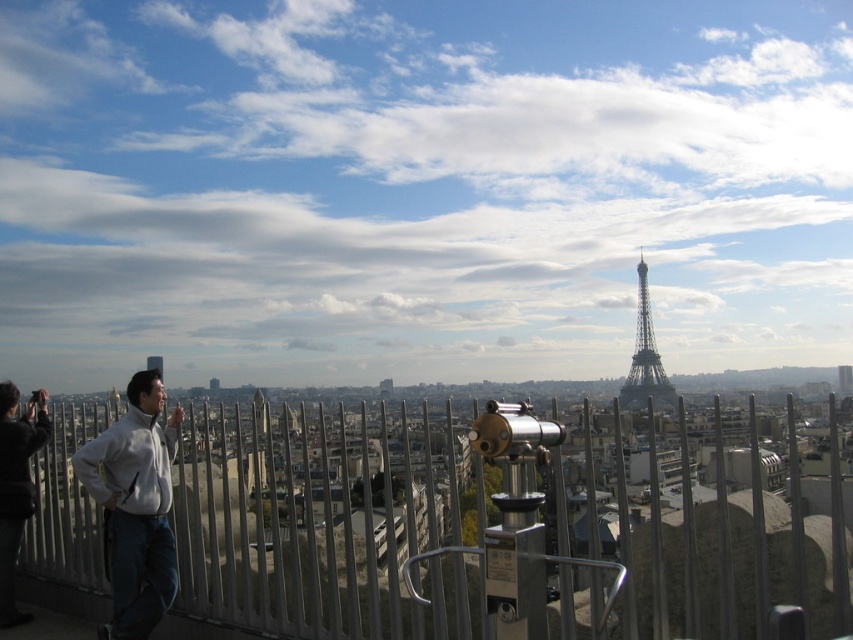
You are a drone operator planning to fly a drone from the metallic silver fence at center to the camera. The drone has a maximum range of 400 meters. Can the drone safely make the trip without losing signal?

The metallic silver fence at center and camera are 468.37 meters apart from each other. Since the drone has a maximum range of 400 meters, it cannot safely make the trip without losing signal because the distance exceeds its range.

Looking at this image, you are standing at the viewpoint and want to take a photo of the shiny metallic eiffel tower at center without the metallic silver fence at center blocking the view. Is the fence in front of or behind the tower?

The metallic silver fence at center is located below shiny metallic eiffel tower at center, which means it is in front of the tower. To avoid the fence blocking the view, you would need to position yourself so that the fence is not between you and the tower.